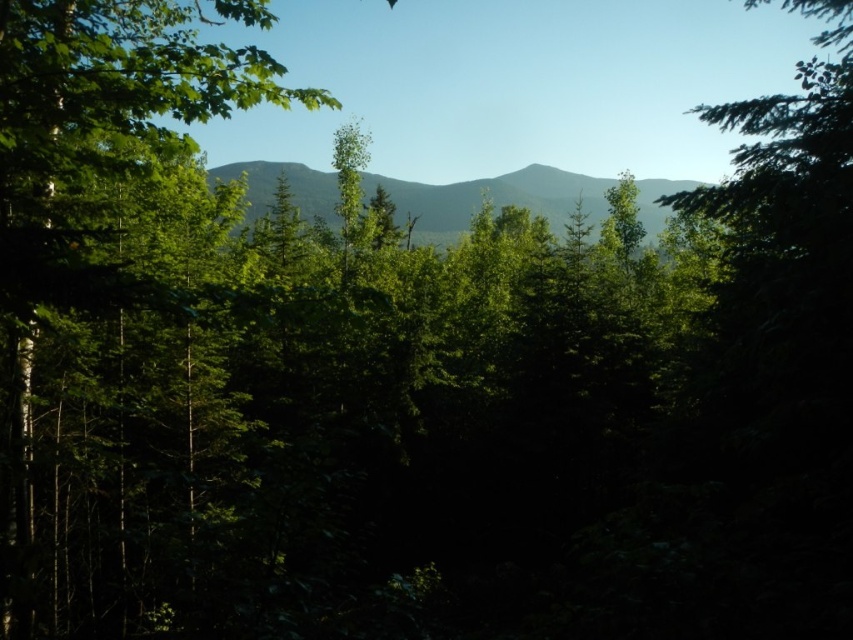
Question: Is green leafy tree at left further to the viewer compared to green textured mountain at center?

Choices:
 (A) no
 (B) yes

Answer: (A)

Question: Does green leafy tree at left have a lesser width compared to green textured mountain at center?

Choices:
 (A) yes
 (B) no

Answer: (A)

Question: Which of the following is the farthest from the observer?

Choices:
 (A) green textured mountain at center
 (B) green leafy tree at left

Answer: (A)

Question: Among these objects, which one is farthest from the camera?

Choices:
 (A) green textured mountain at center
 (B) green leafy tree at left

Answer: (A)

Question: Does green leafy tree at left appear on the right side of green textured mountain at center?

Choices:
 (A) yes
 (B) no

Answer: (B)

Question: Among these points, which one is nearest to the camera?

Choices:
 (A) (425, 241)
 (B) (74, 307)

Answer: (B)